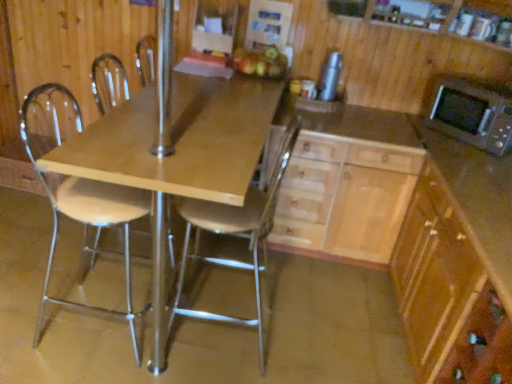
Question: Does white plastic chair at left, arranged as the first chair when viewed from the left, have a smaller size compared to matte wood table at center?

Choices:
 (A) yes
 (B) no

Answer: (A)

Question: Does white plastic chair at left, arranged as the first chair when viewed from the left, appear on the left side of matte wood table at center?

Choices:
 (A) yes
 (B) no

Answer: (A)

Question: Is white plastic chair at left, arranged as the first chair when viewed from the left, not within matte wood table at center?

Choices:
 (A) no
 (B) yes

Answer: (A)

Question: Does white plastic chair at left, arranged as the first chair when viewed from the left, come in front of matte wood table at center?

Choices:
 (A) yes
 (B) no

Answer: (B)

Question: From the image's perspective, would you say white plastic chair at left, the second chair viewed from the right, is shown under matte wood table at center?

Choices:
 (A) no
 (B) yes

Answer: (B)

Question: Based on their positions, is silver metallic microwave oven at upper right located to the left or right of wooden cabinet at center?

Choices:
 (A) left
 (B) right

Answer: (B)

Question: Does point (465, 124) appear closer or farther from the camera than point (323, 153)?

Choices:
 (A) closer
 (B) farther

Answer: (A)

Question: Considering the positions of silver metallic microwave oven at upper right and wooden cabinet at center in the image, is silver metallic microwave oven at upper right wider or thinner than wooden cabinet at center?

Choices:
 (A) thin
 (B) wide

Answer: (A)

Question: Considering the positions of silver metallic microwave oven at upper right and wooden cabinet at center in the image, is silver metallic microwave oven at upper right bigger or smaller than wooden cabinet at center?

Choices:
 (A) small
 (B) big

Answer: (A)

Question: Based on their sizes in the image, would you say matte wood table at center is bigger or smaller than light wood/wooden cabinet at center, acting as the second cabinetry starting from the right?

Choices:
 (A) big
 (B) small

Answer: (A)

Question: Considering the positions of matte wood table at center and light wood/wooden cabinet at center, acting as the second cabinetry starting from the right, in the image, is matte wood table at center taller or shorter than light wood/wooden cabinet at center, acting as the second cabinetry starting from the right,?

Choices:
 (A) tall
 (B) short

Answer: (A)

Question: Is matte wood table at center in front of or behind light wood/wooden cabinet at center, the first cabinetry viewed from the left, in the image?

Choices:
 (A) front
 (B) behind

Answer: (A)

Question: Considering the positions of point (245, 127) and point (340, 248), is point (245, 127) closer or farther from the camera than point (340, 248)?

Choices:
 (A) farther
 (B) closer

Answer: (B)

Question: Considering the positions of silver metallic thermos at upper right and metallic silver chair at center, the 1th chair in the right-to-left sequence, in the image, is silver metallic thermos at upper right wider or thinner than metallic silver chair at center, the 1th chair in the right-to-left sequence,?

Choices:
 (A) wide
 (B) thin

Answer: (B)

Question: From a real-world perspective, is silver metallic thermos at upper right above or below metallic silver chair at center, which is counted as the second chair, starting from the left?

Choices:
 (A) above
 (B) below

Answer: (A)